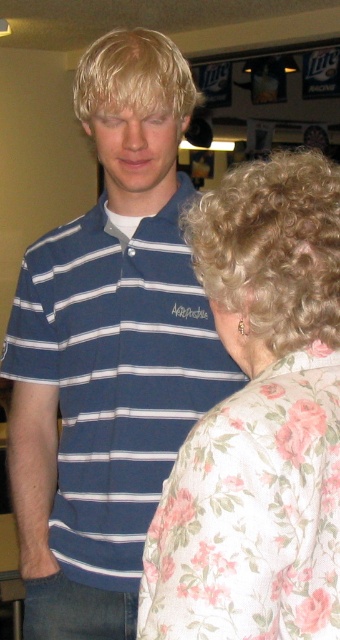
Question: Is blue striped polo shirt at center bigger than floral fabric blouse at right?

Choices:
 (A) yes
 (B) no

Answer: (A)

Question: Can you confirm if blue striped polo shirt at center is positioned below floral fabric blouse at right?

Choices:
 (A) yes
 (B) no

Answer: (B)

Question: Which object appears farthest from the camera in this image?

Choices:
 (A) blue striped polo shirt at center
 (B) floral fabric blouse at right

Answer: (A)

Question: Can you confirm if blue striped polo shirt at center is positioned above floral fabric blouse at right?

Choices:
 (A) no
 (B) yes

Answer: (B)